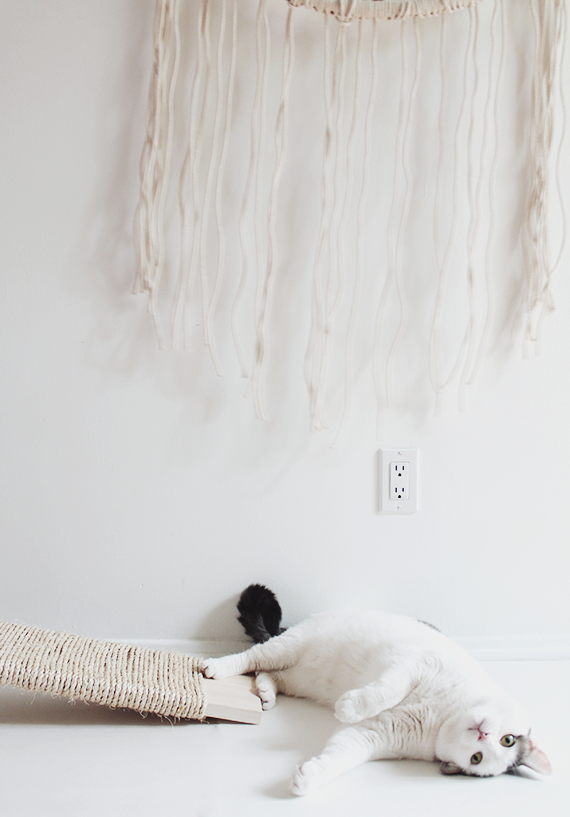
Where is `white wall`? Image resolution: width=570 pixels, height=817 pixels. white wall is located at coordinates (300, 463).